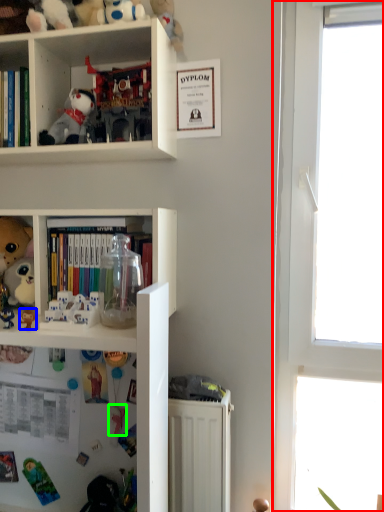
Question: Considering the real-world distances, which object is farthest from window (highlighted by a red box)? toy (highlighted by a blue box) or toy (highlighted by a green box)?

Choices:
 (A) toy
 (B) toy

Answer: (A)